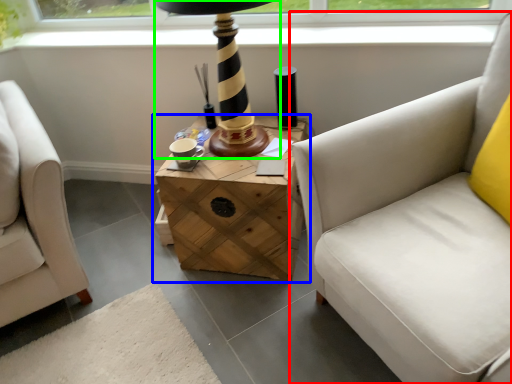
Question: Estimate the real-world distances between objects in this image. Which object is closer to studio couch (highlighted by a red box), table (highlighted by a blue box) or table lamp (highlighted by a green box)?

Choices:
 (A) table
 (B) table lamp

Answer: (A)